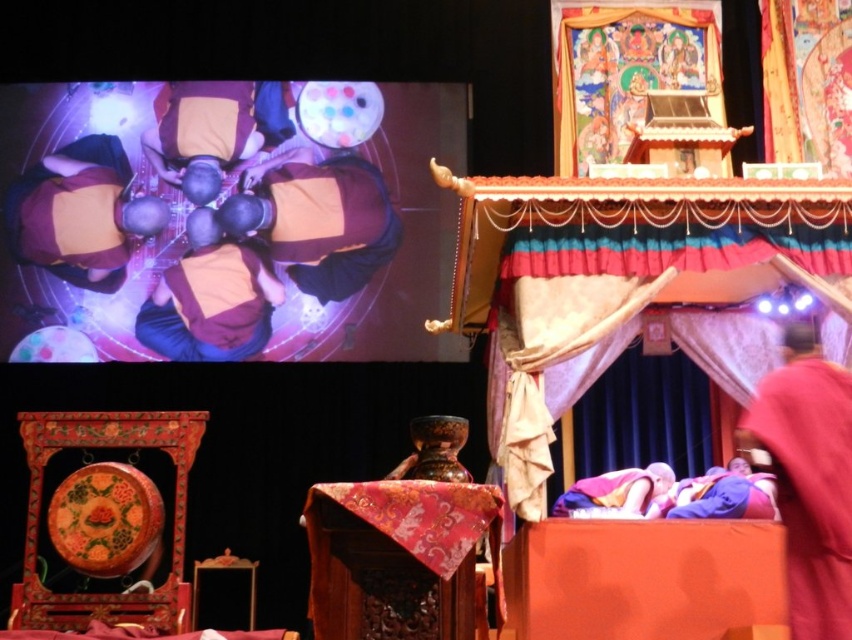
Is red velvet robe at lower right closer to camera compared to brown leather purse at upper center?

That is True.

Is red velvet robe at lower right smaller than brown leather purse at upper center?

Yes, red velvet robe at lower right is smaller than brown leather purse at upper center.

Between point (797, 378) and point (296, 173), which one is positioned in front?

Point (797, 378) is more forward.

This screenshot has width=852, height=640. In order to click on red velvet robe at lower right in this screenshot , I will do `click(809, 484)`.

Does red velvet robe at lower right come behind purple soft fabric at lower center?

No, it is in front of purple soft fabric at lower center.

Which is below, red velvet robe at lower right or purple soft fabric at lower center?

purple soft fabric at lower center

Between point (833, 634) and point (563, 500), which one is positioned in front?

Point (833, 634) is more forward.

The height and width of the screenshot is (640, 852). Find the location of `red velvet robe at lower right`. red velvet robe at lower right is located at coordinates (809, 484).

Which of these two, red velvet robe at lower right or matte brown robe at upper left, stands shorter?

With less height is red velvet robe at lower right.

Does point (799, 490) lie behind point (91, 268)?

No, (799, 490) is closer to viewer.

Locate an element on the screen. The image size is (852, 640). red velvet robe at lower right is located at coordinates (809, 484).